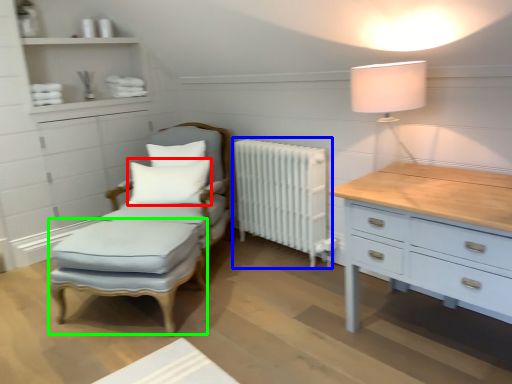
Question: Which object is positioned farthest from pillow (highlighted by a red box)? Select from radiator (highlighted by a blue box) and footrest (highlighted by a green box).

Choices:
 (A) radiator
 (B) footrest

Answer: (A)